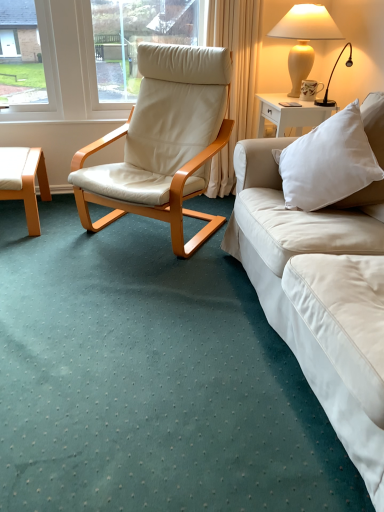
Question: Is light brown wood coffee table at left oriented away from matte cream vase at upper right?

Choices:
 (A) yes
 (B) no

Answer: (B)

Question: Is light brown wood coffee table at left positioned before matte cream vase at upper right?

Choices:
 (A) yes
 (B) no

Answer: (B)

Question: Does light brown wood coffee table at left have a greater height compared to matte cream vase at upper right?

Choices:
 (A) yes
 (B) no

Answer: (B)

Question: Can you confirm if light brown wood coffee table at left is positioned to the right of matte cream vase at upper right?

Choices:
 (A) no
 (B) yes

Answer: (A)

Question: Are light brown wood coffee table at left and matte cream vase at upper right beside each other?

Choices:
 (A) no
 (B) yes

Answer: (A)

Question: In terms of size, does white soft cushion at right appear bigger or smaller than matte cream vase at upper right?

Choices:
 (A) small
 (B) big

Answer: (B)

Question: Considering the positions of white soft cushion at right and matte cream vase at upper right in the image, is white soft cushion at right wider or thinner than matte cream vase at upper right?

Choices:
 (A) wide
 (B) thin

Answer: (A)

Question: From their relative heights in the image, would you say white soft cushion at right is taller or shorter than matte cream vase at upper right?

Choices:
 (A) tall
 (B) short

Answer: (B)

Question: Based on their positions, is white soft cushion at right located to the left or right of matte cream vase at upper right?

Choices:
 (A) left
 (B) right

Answer: (A)

Question: Based on their sizes in the image, would you say matte ceramic mug at upper right is bigger or smaller than beige leather chair at center?

Choices:
 (A) small
 (B) big

Answer: (A)

Question: In terms of width, does matte ceramic mug at upper right look wider or thinner when compared to beige leather chair at center?

Choices:
 (A) wide
 (B) thin

Answer: (B)

Question: Is matte ceramic mug at upper right spatially inside beige leather chair at center, or outside of it?

Choices:
 (A) outside
 (B) inside

Answer: (A)

Question: Is matte ceramic mug at upper right taller or shorter than beige leather chair at center?

Choices:
 (A) short
 (B) tall

Answer: (A)

Question: From their relative heights in the image, would you say matte ceramic mug at upper right is taller or shorter than light brown wood coffee table at left?

Choices:
 (A) tall
 (B) short

Answer: (B)

Question: Is point (311, 95) positioned closer to the camera than point (44, 174)?

Choices:
 (A) farther
 (B) closer

Answer: (B)